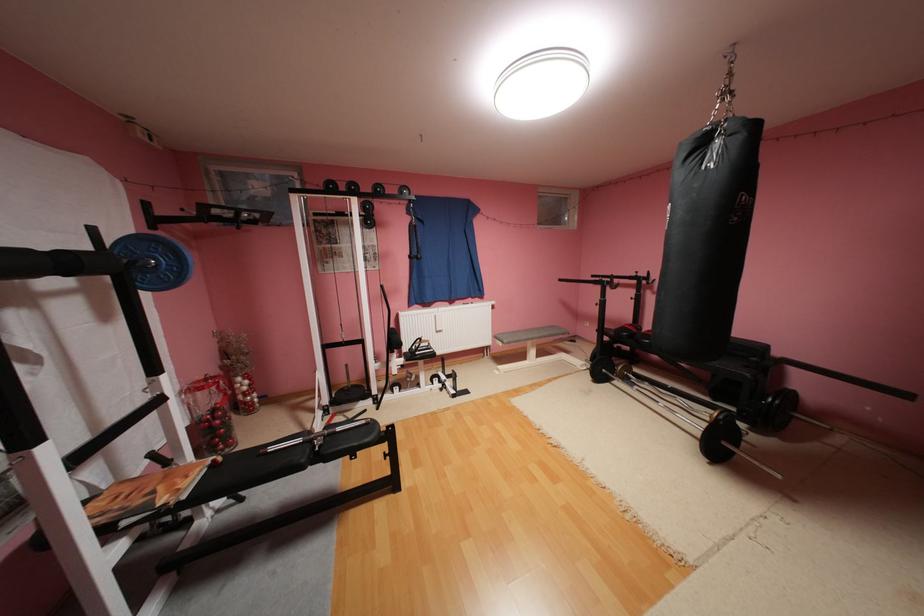
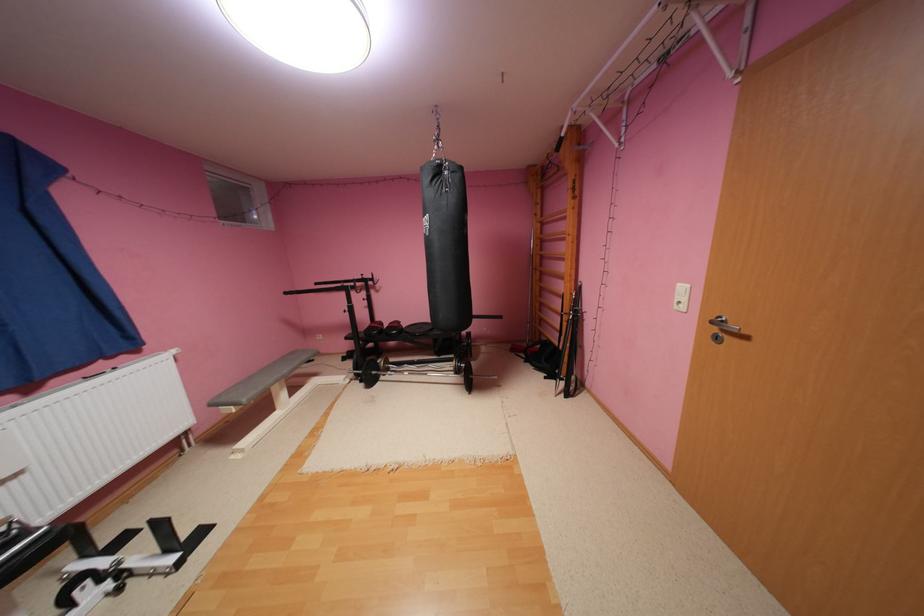
Locate, in the second image, the point that corresponds to (x=711, y=142) in the first image.

(446, 171)